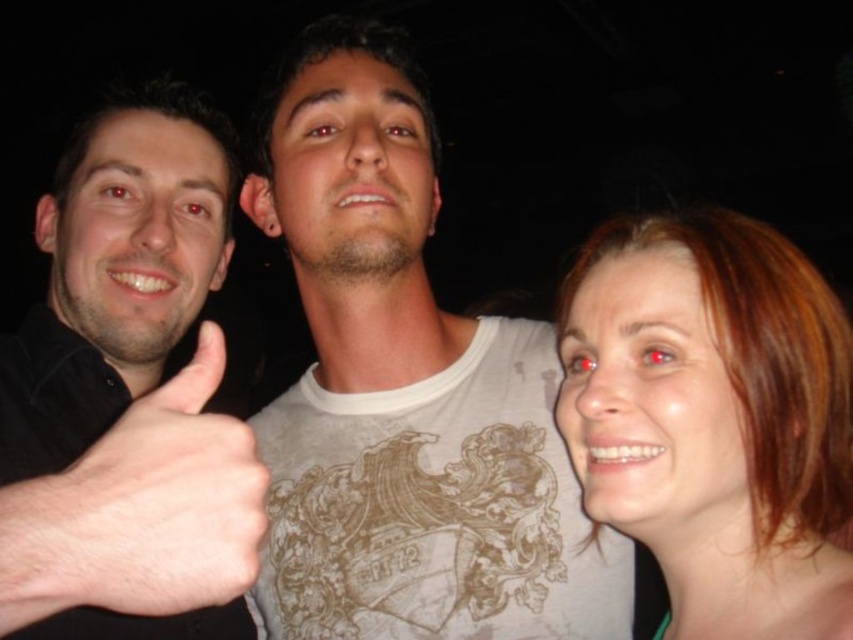
Identify the location of blonde hair at right. The image size is (853, 640). (714, 417).

Is point (567, 500) farther from viewer compared to point (662, 262)?

Yes, point (567, 500) is farther from viewer.

Find the location of a particular element. white matte t-shirt at center is located at coordinates (404, 392).

What are the coordinates of `white matte t-shirt at center` in the screenshot? It's located at (404, 392).

Can you confirm if white matte t-shirt at center is shorter than skinny white hand at left?

No.

Who is more forward, (350, 499) or (15, 609)?

Positioned in front is point (15, 609).

Where is `white matte t-shirt at center`? white matte t-shirt at center is located at coordinates (404, 392).

You are a GUI agent. You are given a task and a screenshot of the screen. Output one action in this format:
    pyautogui.click(x=<x>, y=<y>)
    Task: Click on the white matte t-shirt at center
    
    Given the screenshot: What is the action you would take?
    pyautogui.click(x=404, y=392)